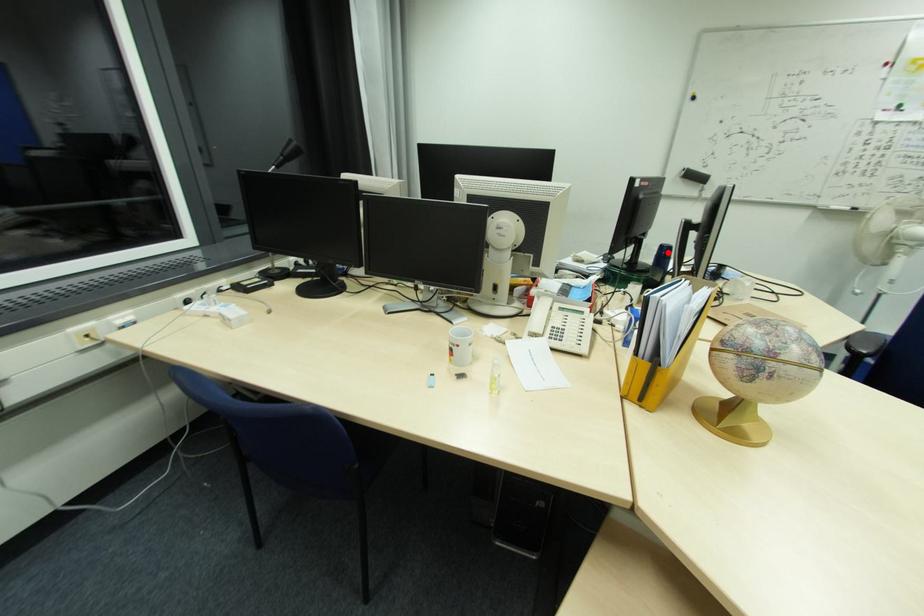
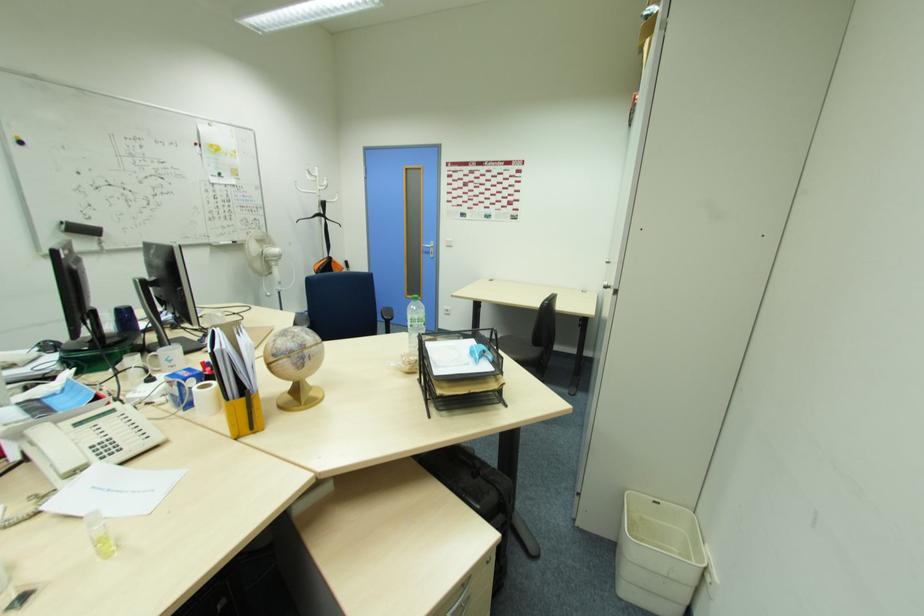
Question: I am providing you with two images of the same scene from different viewpoints. In image1, a red point is highlighted. Considering the same 3D point in image2, which of the following is correct?

Choices:
 (A) It is closer
 (B) It is farther

Answer: (B)